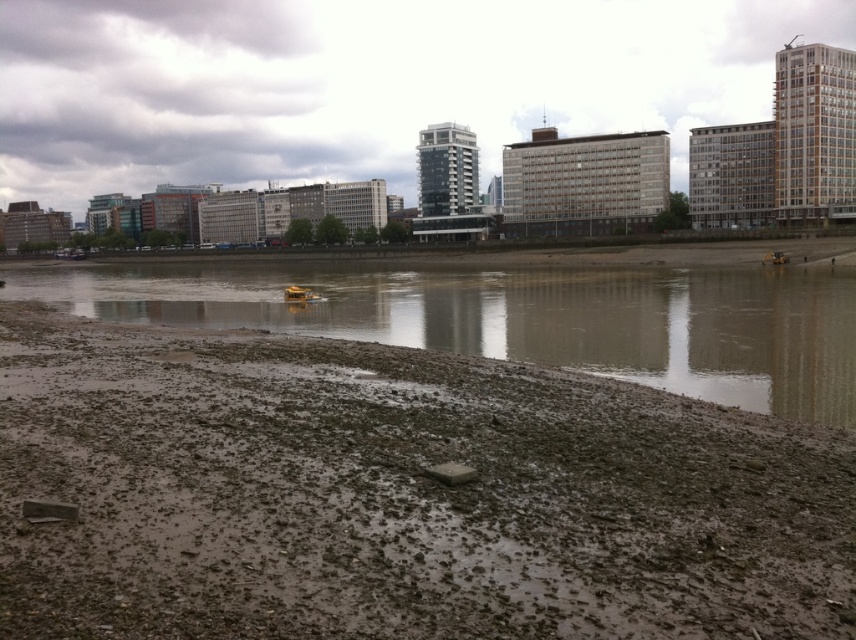
Question: Which of the following is the closest to the observer?

Choices:
 (A) muddy sand at lower left
 (B) muddy wet ground at lower left

Answer: (B)

Question: Is muddy wet ground at lower left in front of muddy sand at lower left?

Choices:
 (A) yes
 (B) no

Answer: (A)

Question: Is muddy wet ground at lower left positioned behind muddy sand at lower left?

Choices:
 (A) no
 (B) yes

Answer: (A)

Question: In this image, where is muddy wet ground at lower left located relative to muddy sand at lower left?

Choices:
 (A) left
 (B) right

Answer: (B)